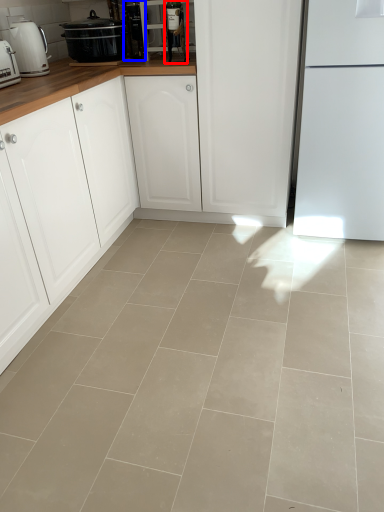
Question: Which of the following is the farthest to the observer, appliance (highlighted by a red box) or appliance (highlighted by a blue box)?

Choices:
 (A) appliance
 (B) appliance

Answer: (B)